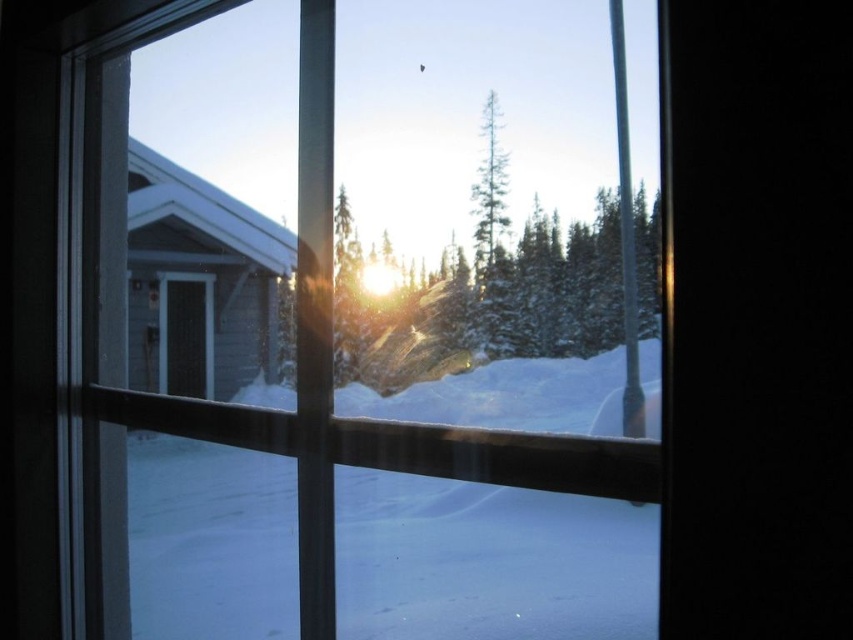
Can you confirm if transparent glass window at center is positioned to the left of green matte tree at center?

In fact, transparent glass window at center is to the right of green matte tree at center.

Can you confirm if transparent glass window at center is shorter than green matte tree at center?

No, transparent glass window at center is not shorter than green matte tree at center.

Consider the image. Measure the distance between point (100, 109) and camera.

A distance of 6.44 feet exists between point (100, 109) and camera.

The height and width of the screenshot is (640, 853). Find the location of `transparent glass window at center`. transparent glass window at center is located at coordinates (368, 324).